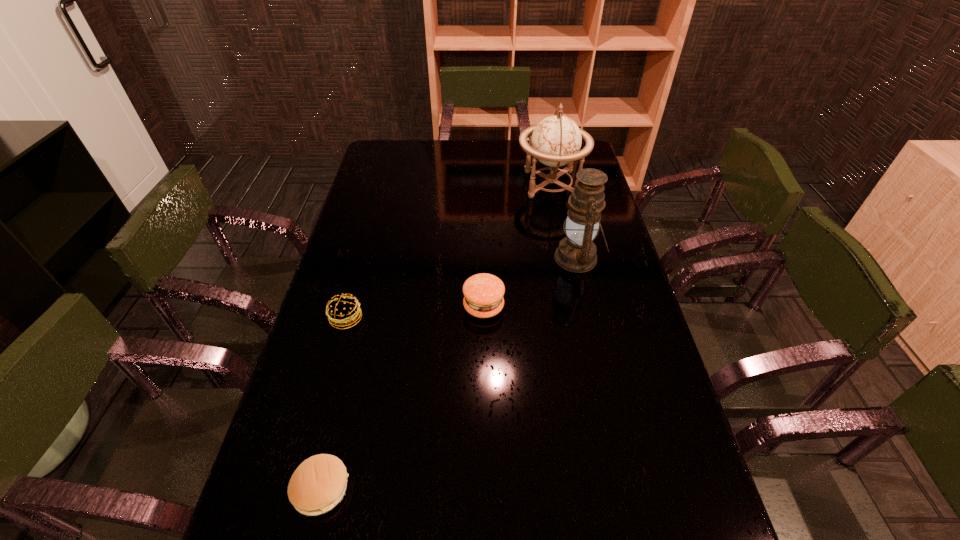
Locate an element on the screen. This screenshot has height=540, width=960. the farthest object is located at coordinates (556, 141).

Locate an element on the screen. The width and height of the screenshot is (960, 540). oil lamp is located at coordinates (576, 253).

The width and height of the screenshot is (960, 540). Identify the location of the third object from right to left. (483, 293).

At what (x,y) coordinates should I click in order to perform the action: click on the rightmost patty. Please return your answer as a coordinate pair (x, y). Looking at the image, I should click on (483, 293).

The image size is (960, 540). Find the location of `the second tallest patty`. the second tallest patty is located at coordinates (343, 312).

Where is `the nearest patty`? The width and height of the screenshot is (960, 540). the nearest patty is located at coordinates (319, 483).

Locate an element on the screen. The width and height of the screenshot is (960, 540). the shortest object is located at coordinates (319, 483).

This screenshot has width=960, height=540. I want to click on free space located on the front-facing side of the farthest object, so click(x=483, y=184).

You are a GUI agent. You are given a task and a screenshot of the screen. Output one action in this format:
    pyautogui.click(x=<x>, y=<y>)
    Task: Click on the free space located on the front-facing side of the farthest object
    
    Given the screenshot: What is the action you would take?
    pos(472,184)

Locate an element on the screen. The height and width of the screenshot is (540, 960). free space located 0.070m on the front-facing side of the farthest object is located at coordinates (498, 184).